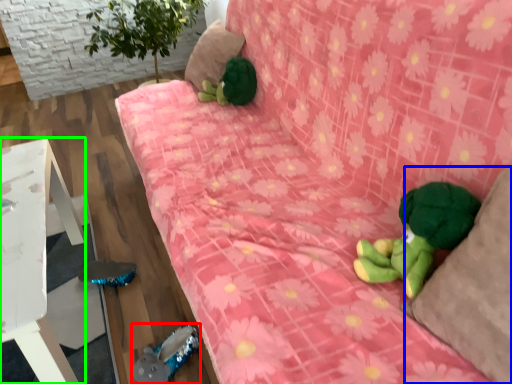
Question: Estimate the real-world distances between objects in this image. Which object is closer to toy (highlighted by a red box), pillow (highlighted by a blue box) or furniture (highlighted by a green box)?

Choices:
 (A) pillow
 (B) furniture

Answer: (B)